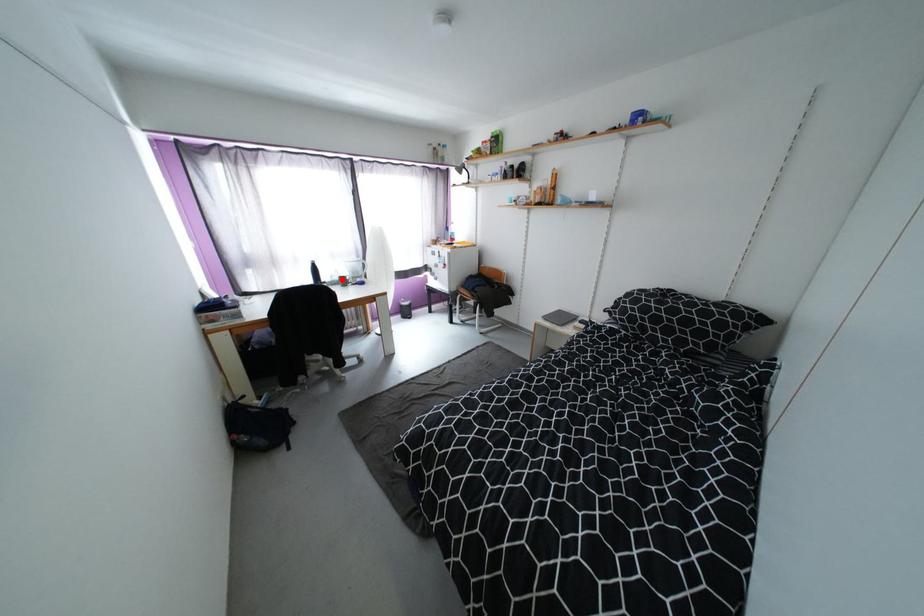
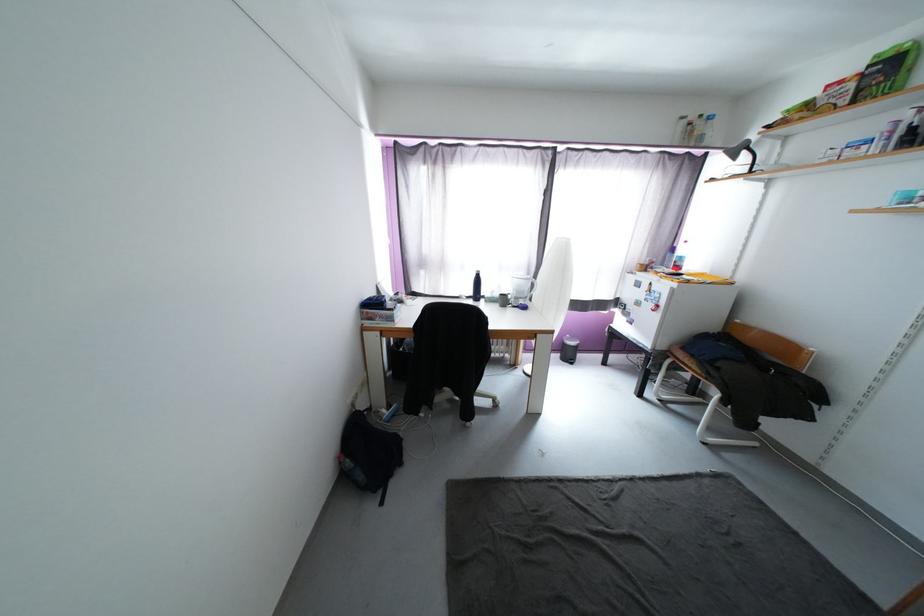
Find the pixel in the second image that matches the highlighted location in the first image.

(503, 296)